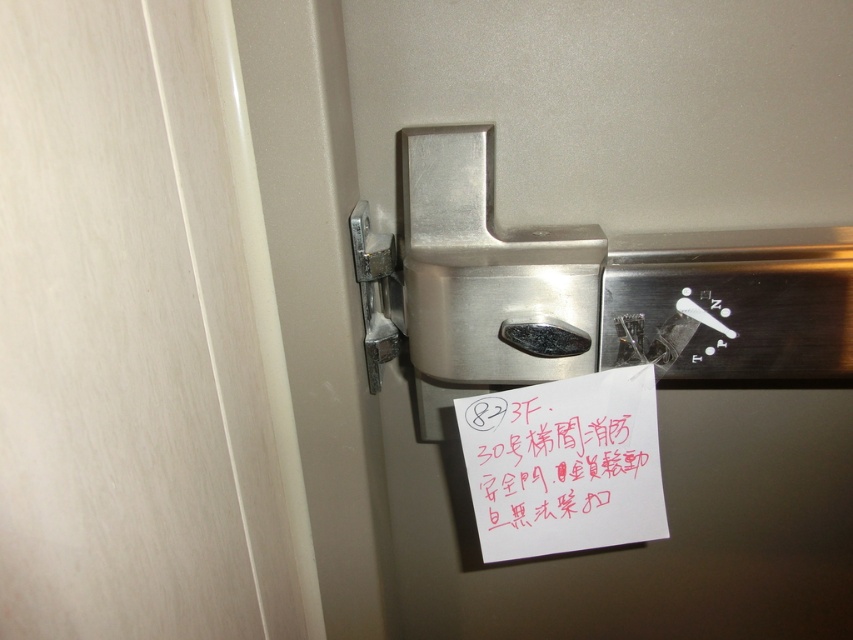
You are standing in front of a door with a metal latch mechanism and a handwritten note attached to it. You need to reach a point that is exactly 66.20 centimeters away from your current position. Can you determine if the point at coordinates point (x=577, y=531) is within reach of your outstretched hand?

The point (x=577, y=531) is 66.20 centimeters away from the camera. Since the average human arm length is about 60 centimeters, you would need to stretch your arm fully to reach it, but it might be slightly out of reach depending on individual arm length.

You are a delivery person trying to attach a package slip to the door. The slip is the same size as the satin silver hinge at upper right. Is there enough space on the door to place the slip next to the white paper at center without overlapping?

The white paper at center is larger in size than the satin silver hinge at upper right. Since the package slip is the same size as the hinge, it would be smaller than the white paper. However, the available space next to the white paper depends on the total door surface area and other potential obstructions not mentioned in the scene description. The scene does not provide information about the door dimensions or other objects occupying space, so it is uncertain if there is enough space to place the slip.

You are standing in front of the door with the metal latch mechanism and notice a point at coordinate (437, 584). Can you reach this point with your hand if you are 170 cm tall?

The point at coordinate (437, 584) is 83.82 centimeters from the viewer. Since the viewer is 170 cm tall, they can easily reach this point with their hand as it is within arm reach distance.